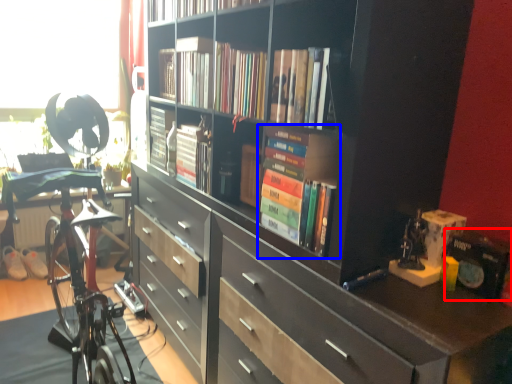
Question: Which of the following is the closest to the observer, paperback book (highlighted by a red box) or book (highlighted by a blue box)?

Choices:
 (A) paperback book
 (B) book

Answer: (A)